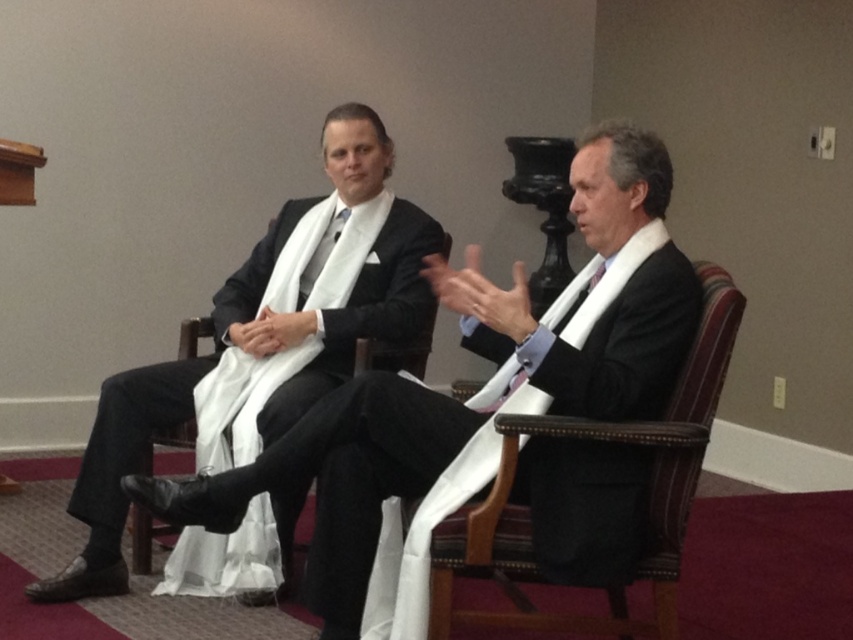
Is point (161, 490) closer to camera compared to point (700, 321)?

No, it is behind (700, 321).

Can you confirm if matte black suit at center is shorter than brown leather chair at right?

Incorrect, matte black suit at center's height does not fall short of brown leather chair at right's.

Where is `matte black suit at center`? The width and height of the screenshot is (853, 640). matte black suit at center is located at coordinates (473, 396).

Does matte black suit at center appear on the left side of purple satin tie at center?

Correct, you'll find matte black suit at center to the left of purple satin tie at center.

Which is more to the right, matte black suit at center or purple satin tie at center?

purple satin tie at center

Locate an element on the screen. The image size is (853, 640). matte black suit at center is located at coordinates (473, 396).

Find the location of `matte black suit at center`. matte black suit at center is located at coordinates (473, 396).

Does brown leather chair at right lie behind purple satin tie at center?

No, it is not.

The height and width of the screenshot is (640, 853). What do you see at coordinates (648, 504) in the screenshot?
I see `brown leather chair at right` at bounding box center [648, 504].

At what (x,y) coordinates should I click in order to perform the action: click on brown leather chair at right. Please return your answer as a coordinate pair (x, y). Image resolution: width=853 pixels, height=640 pixels. Looking at the image, I should click on (648, 504).